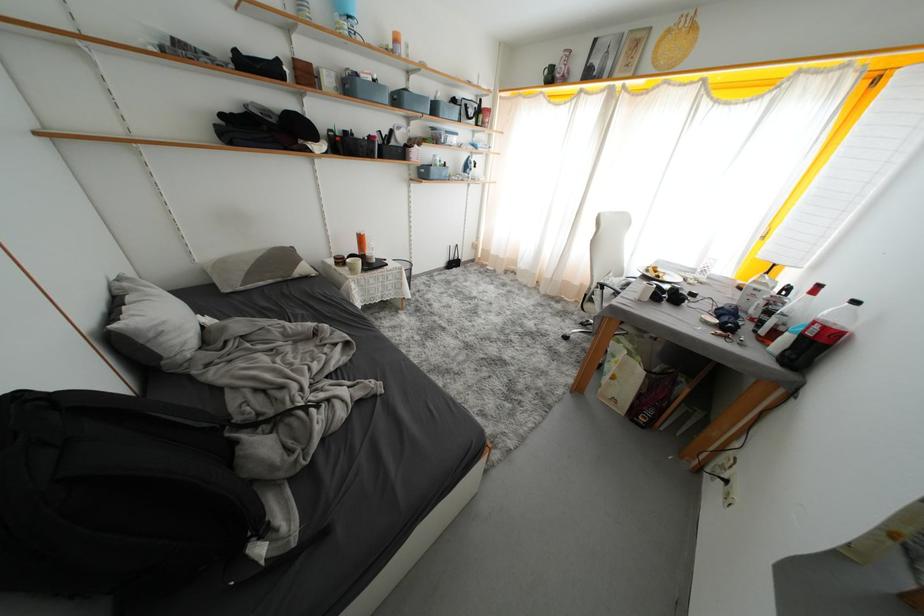
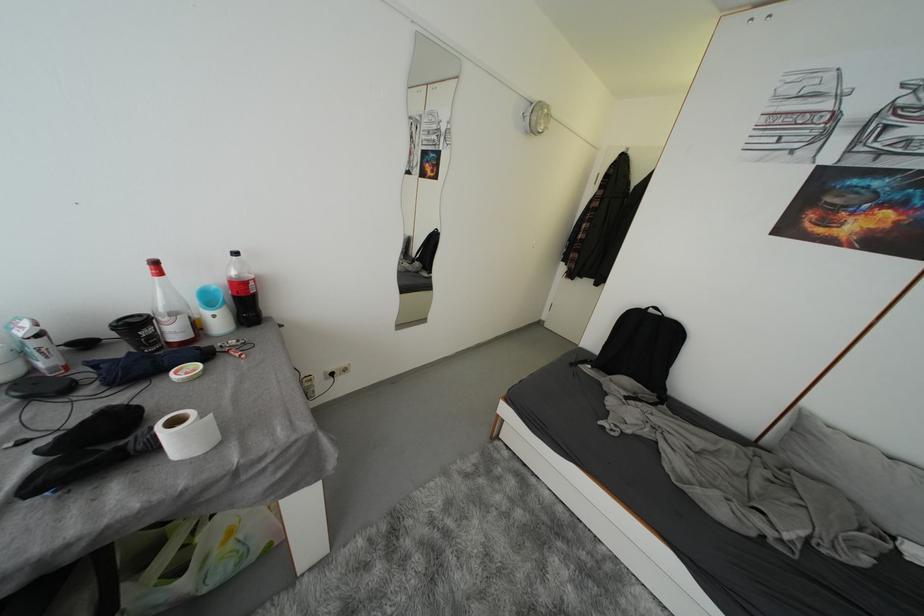
In the second image, find the point that corresponds to the point at 782,337 in the first image.

(202, 329)